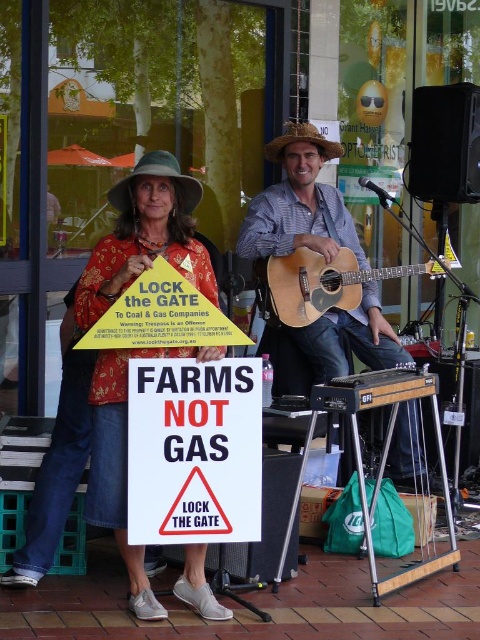
Between floral fabric shirt at center and green felt cowboy hat at upper center, which one appears on the left side from the viewer's perspective?

floral fabric shirt at center is more to the left.

Who is more forward, (x=175, y=264) or (x=184, y=202)?

Point (x=175, y=264) is more forward.

This screenshot has width=480, height=640. I want to click on floral fabric shirt at center, so click(x=145, y=236).

Who is shorter, white paper sign at center or wooden acoustic guitar at center?

white paper sign at center is shorter.

Can you confirm if white paper sign at center is thinner than wooden acoustic guitar at center?

Indeed, white paper sign at center has a lesser width compared to wooden acoustic guitar at center.

Is point (137, 502) behind point (367, 360)?

That is False.

At what (x,y) coordinates should I click in order to perform the action: click on white paper sign at center. Please return your answer as a coordinate pair (x, y). Looking at the image, I should click on (193, 451).

Is floral fabric shirt at center taller than strawhat at center?

Result: Correct, floral fabric shirt at center is much taller as strawhat at center.

This screenshot has width=480, height=640. Identify the location of floral fabric shirt at center. (145, 236).